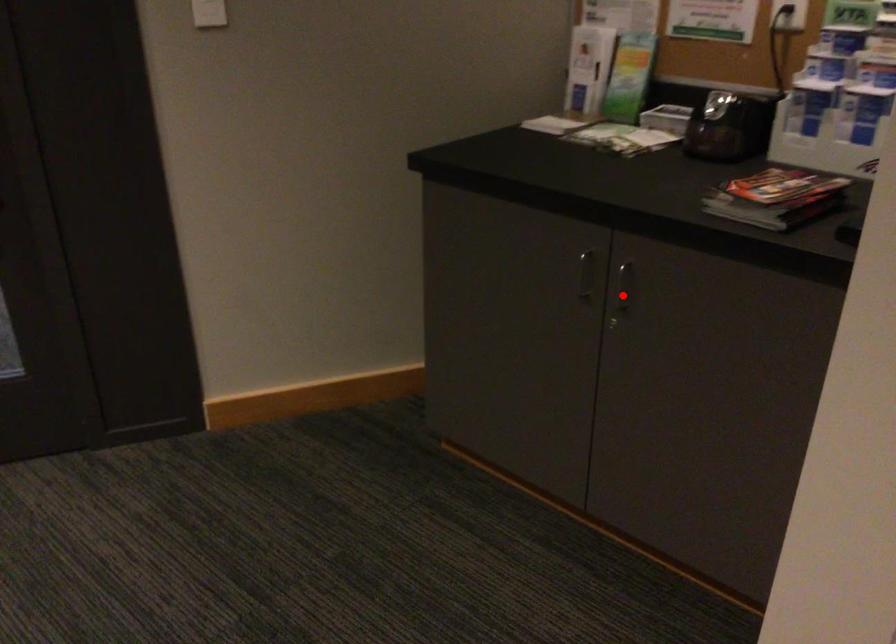
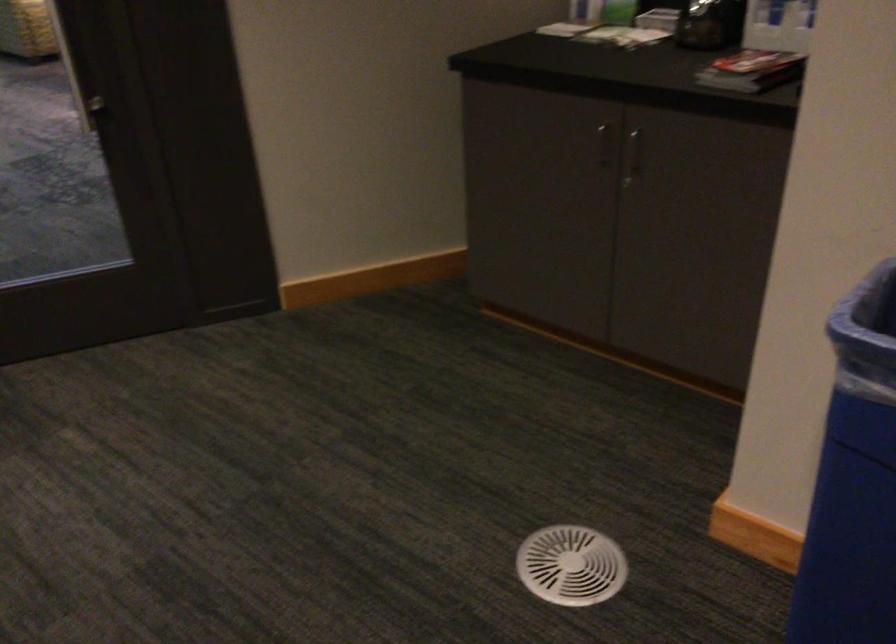
Find the pixel in the second image that matches the highlighted location in the first image.

(633, 155)